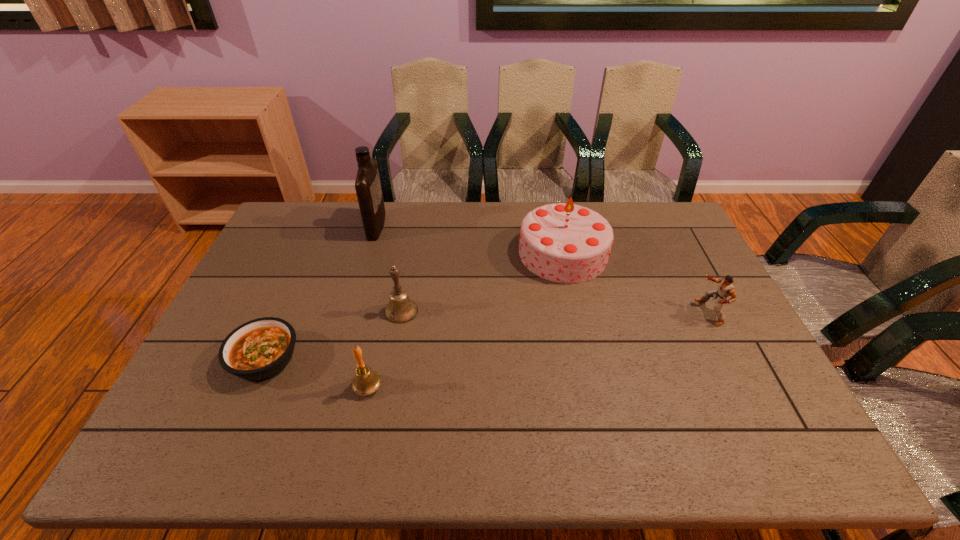
Find the location of `vacant point located between the farther bell and the rightmost object`. vacant point located between the farther bell and the rightmost object is located at coordinates (555, 312).

Where is `vacant point located between the stew and the fifth object from right to left`? vacant point located between the stew and the fifth object from right to left is located at coordinates (321, 293).

This screenshot has height=540, width=960. In order to click on unoccupied area between the nearer bell and the fifth object from right to left in this screenshot , I will do `click(372, 306)`.

At what (x,y) coordinates should I click in order to perform the action: click on empty location between the nearer bell and the fifth shortest object. Please return your answer as a coordinate pair (x, y). This screenshot has width=960, height=540. Looking at the image, I should click on (466, 320).

This screenshot has height=540, width=960. What are the coordinates of `empty space that is in between the puncher and the stew` in the screenshot? It's located at (488, 335).

Where is `object that is the closest to the birthday cake`? This screenshot has height=540, width=960. object that is the closest to the birthday cake is located at coordinates click(726, 288).

Identify which object is located as the second nearest to the puncher. Please provide its 2D coordinates. Your answer should be formatted as a tuple, i.e. [(x, y)], where the tuple contains the x and y coordinates of a point satisfying the conditions above.

[(401, 309)]

You are a GUI agent. You are given a task and a screenshot of the screen. Output one action in this format:
    pyautogui.click(x=<x>, y=<y>)
    Task: Click on the vacant space that satisfies the following two spatial constraints: 1. on the back side of the farther bell; 2. on the left side of the leftmost object
    This screenshot has width=960, height=540.
    Given the screenshot: What is the action you would take?
    (x=286, y=311)

Locate an element on the screen. free space that satisfies the following two spatial constraints: 1. on the back side of the fifth object from left to right; 2. on the left side of the stew is located at coordinates (312, 253).

At what (x,y) coordinates should I click in order to perform the action: click on vacant area that satisfies the following two spatial constraints: 1. on the label side of the farther bell; 2. on the right side of the tallest object. Please return your answer as a coordinate pair (x, y). Looking at the image, I should click on (351, 311).